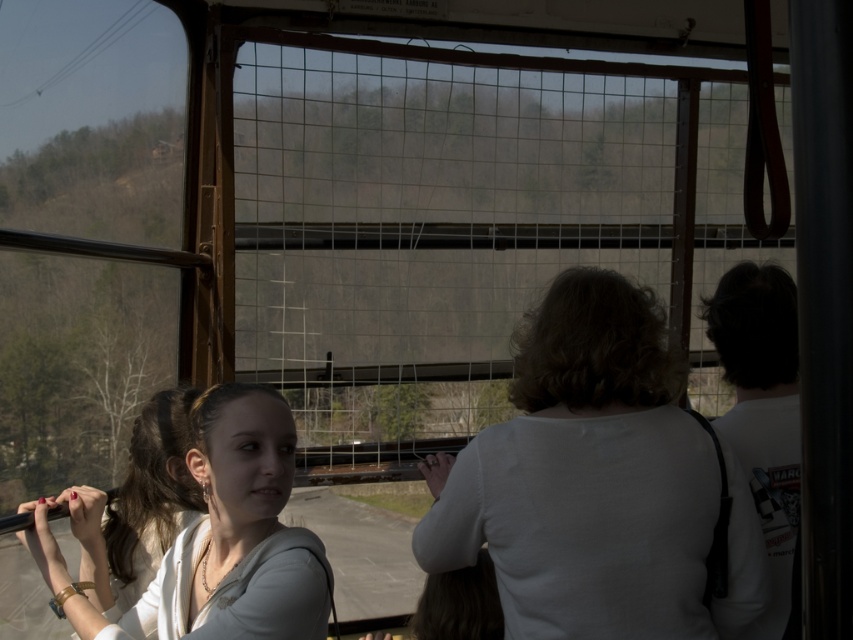
Question: Is the position of matte white shirt at left more distant than that of white matte shirt at right?

Choices:
 (A) yes
 (B) no

Answer: (B)

Question: Can you confirm if white matte shirt at center is bigger than matte white shirt at left?

Choices:
 (A) no
 (B) yes

Answer: (A)

Question: Estimate the real-world distances between objects in this image. Which object is closer to the white matte shirt at right?

Choices:
 (A) white matte shirt at center
 (B) matte white shirt at left

Answer: (A)

Question: Considering the relative positions of white matte shirt at center and white matte shirt at right in the image provided, where is white matte shirt at center located with respect to white matte shirt at right?

Choices:
 (A) below
 (B) above

Answer: (A)

Question: Which of these objects is positioned farthest from the white matte shirt at right?

Choices:
 (A) matte white shirt at left
 (B) white matte shirt at center

Answer: (A)

Question: Which of the following is the farthest from the observer?

Choices:
 (A) (136, 625)
 (B) (787, 428)

Answer: (B)